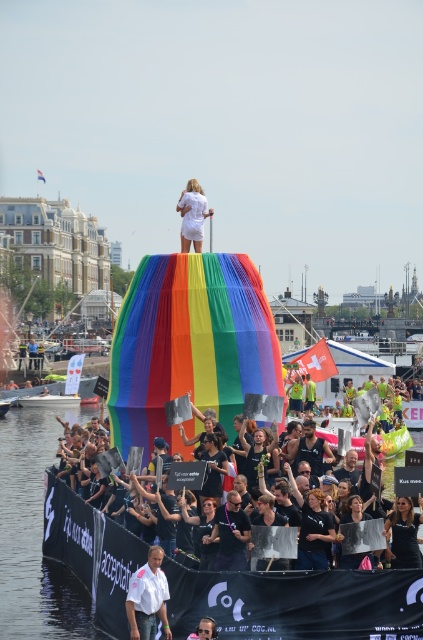
Question: Which object is farther from the camera taking this photo?

Choices:
 (A) white plastic boat at center
 (B) white matte shirt at lower center
 (C) black matte shirt at center

Answer: (A)

Question: Considering the relative positions of white matte shirt at lower center and black matte shirt at center in the image provided, where is white matte shirt at lower center located with respect to black matte shirt at center?

Choices:
 (A) right
 (B) left

Answer: (B)

Question: Can you confirm if white matte dress at upper center is positioned above black matte shirt at center?

Choices:
 (A) yes
 (B) no

Answer: (A)

Question: Which of the following is the farthest from the observer?

Choices:
 (A) white plastic boat at center
 (B) white matte shirt at lower center

Answer: (A)

Question: Is white matte shirt at lower center smaller than white plastic boat at center?

Choices:
 (A) yes
 (B) no

Answer: (A)

Question: Which point is closer to the camera taking this photo?

Choices:
 (A) (200, 198)
 (B) (308, 454)
 (C) (139, 602)

Answer: (C)